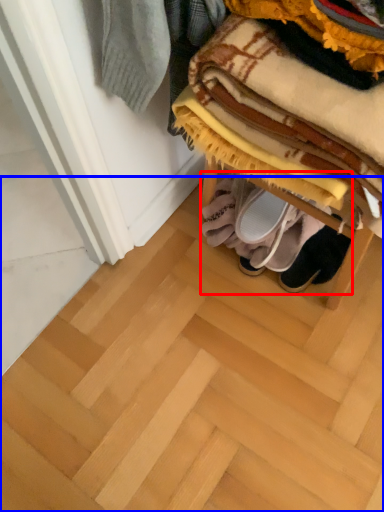
Question: Which point is further to the camera, footwear (highlighted by a red box) or stair (highlighted by a blue box)?

Choices:
 (A) footwear
 (B) stair

Answer: (A)